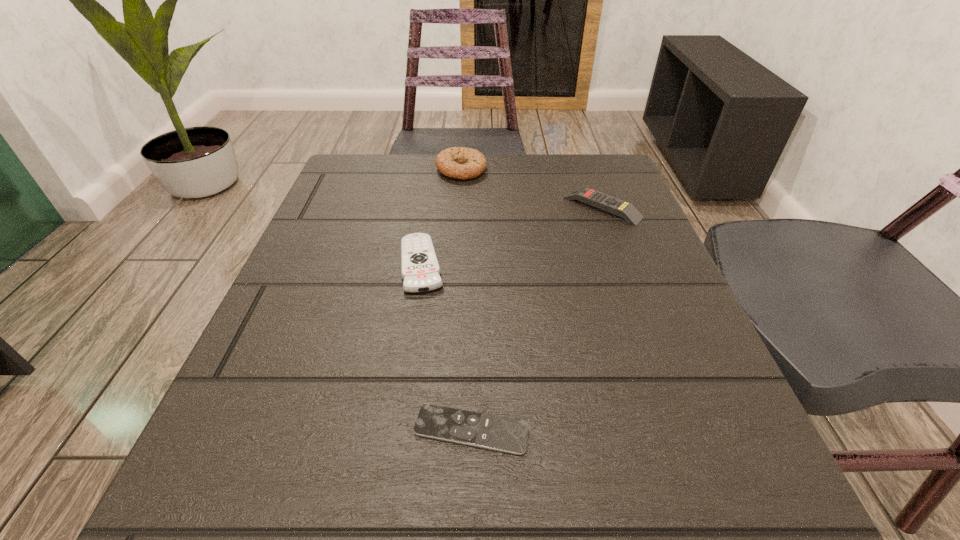
You are a GUI agent. You are given a task and a screenshot of the screen. Output one action in this format:
    pyautogui.click(x=<x>, y=<y>)
    Task: Click on the free space located on the front of the second tallest remote control
    Image resolution: width=960 pixels, height=540 pixels.
    Given the screenshot: What is the action you would take?
    pyautogui.click(x=385, y=503)

Image resolution: width=960 pixels, height=540 pixels. Find the location of `vacant region located on the back of the nearest remote control`. vacant region located on the back of the nearest remote control is located at coordinates (473, 296).

You are a GUI agent. You are given a task and a screenshot of the screen. Output one action in this format:
    pyautogui.click(x=<x>, y=<y>)
    Task: Click on the bagel located at the far edge
    
    Given the screenshot: What is the action you would take?
    pyautogui.click(x=463, y=163)

Locate an element on the screen. This screenshot has height=540, width=960. remote control that is at the far edge is located at coordinates (626, 210).

You are a GUI agent. You are given a task and a screenshot of the screen. Output one action in this format:
    pyautogui.click(x=<x>, y=<y>)
    Task: Click on the object located in the right edge section of the desktop
    
    Given the screenshot: What is the action you would take?
    pyautogui.click(x=626, y=210)

Locate an element on the screen. This screenshot has width=960, height=540. object that is positioned at the far right corner is located at coordinates (626, 210).

Identify the location of free space at the far edge of the desktop. (431, 177).

Identify the location of free space at the near edge. (544, 538).

Where is `vacant area at the left edge`? This screenshot has height=540, width=960. vacant area at the left edge is located at coordinates (260, 427).

The width and height of the screenshot is (960, 540). I want to click on vacant region at the right edge, so point(726,387).